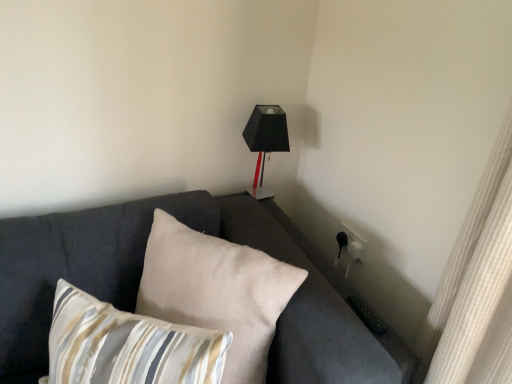
Question: From the image's perspective, is striped fabric pillow at lower left, positioned as the 1th pillow in front-to-back order, above dark gray fabric couch at center?

Choices:
 (A) no
 (B) yes

Answer: (A)

Question: Is striped fabric pillow at lower left, positioned as the 1th pillow in front-to-back order, in contact with dark gray fabric couch at center?

Choices:
 (A) yes
 (B) no

Answer: (B)

Question: Considering the relative sizes of striped fabric pillow at lower left, positioned as the 1th pillow in front-to-back order, and dark gray fabric couch at center in the image provided, is striped fabric pillow at lower left, positioned as the 1th pillow in front-to-back order, wider than dark gray fabric couch at center?

Choices:
 (A) no
 (B) yes

Answer: (A)

Question: Is striped fabric pillow at lower left, placed as the 2th pillow when sorted from back to front, completely or partially outside of dark gray fabric couch at center?

Choices:
 (A) yes
 (B) no

Answer: (B)

Question: From a real-world perspective, is striped fabric pillow at lower left, positioned as the 1th pillow in front-to-back order, located beneath dark gray fabric couch at center?

Choices:
 (A) yes
 (B) no

Answer: (A)

Question: Is striped fabric pillow at lower left, placed as the 2th pillow when sorted from back to front, oriented away from dark gray fabric couch at center?

Choices:
 (A) no
 (B) yes

Answer: (B)

Question: Can we say matte black lampshade at upper right lies outside dark gray fabric couch at center?

Choices:
 (A) no
 (B) yes

Answer: (B)

Question: Does matte black lampshade at upper right have a greater height compared to dark gray fabric couch at center?

Choices:
 (A) yes
 (B) no

Answer: (A)

Question: From the image's perspective, is matte black lampshade at upper right located above dark gray fabric couch at center?

Choices:
 (A) yes
 (B) no

Answer: (A)

Question: Is matte black lampshade at upper right positioned with its back to dark gray fabric couch at center?

Choices:
 (A) no
 (B) yes

Answer: (A)

Question: Considering the relative sizes of matte black lampshade at upper right and dark gray fabric couch at center in the image provided, is matte black lampshade at upper right shorter than dark gray fabric couch at center?

Choices:
 (A) no
 (B) yes

Answer: (A)

Question: From the image's perspective, is matte black lampshade at upper right below dark gray fabric couch at center?

Choices:
 (A) no
 (B) yes

Answer: (A)

Question: From a real-world perspective, is beige fabric pillow at center, which is the first pillow in back-to-front order, on dark gray fabric couch at center?

Choices:
 (A) yes
 (B) no

Answer: (B)